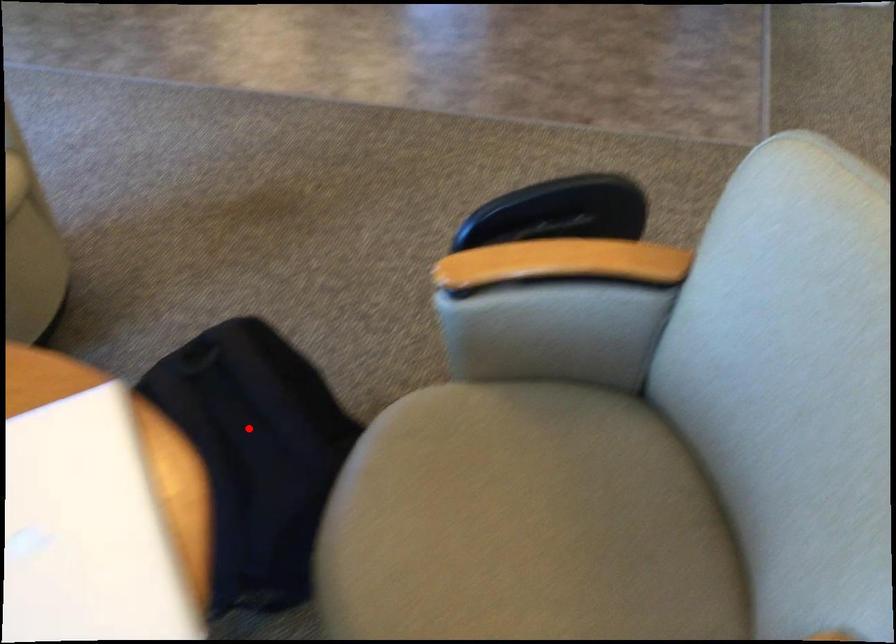
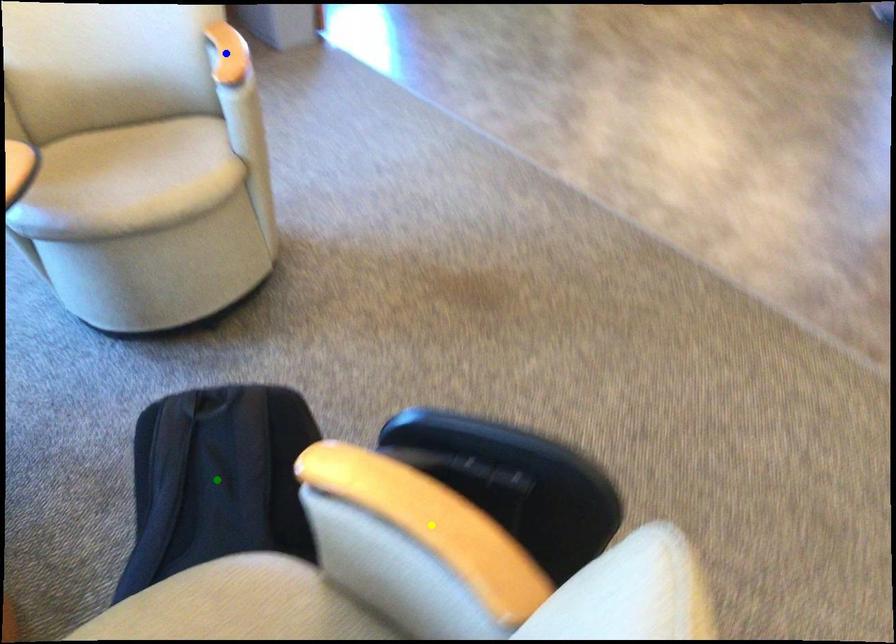
Question: I am providing you with two images of the same scene from different viewpoints. A red point is marked on the first image. You are given multiple points on the second image. In image 2, which mark is for the same physical point as the one in image 1?

Choices:
 (A) green point
 (B) yellow point
 (C) blue point

Answer: (A)